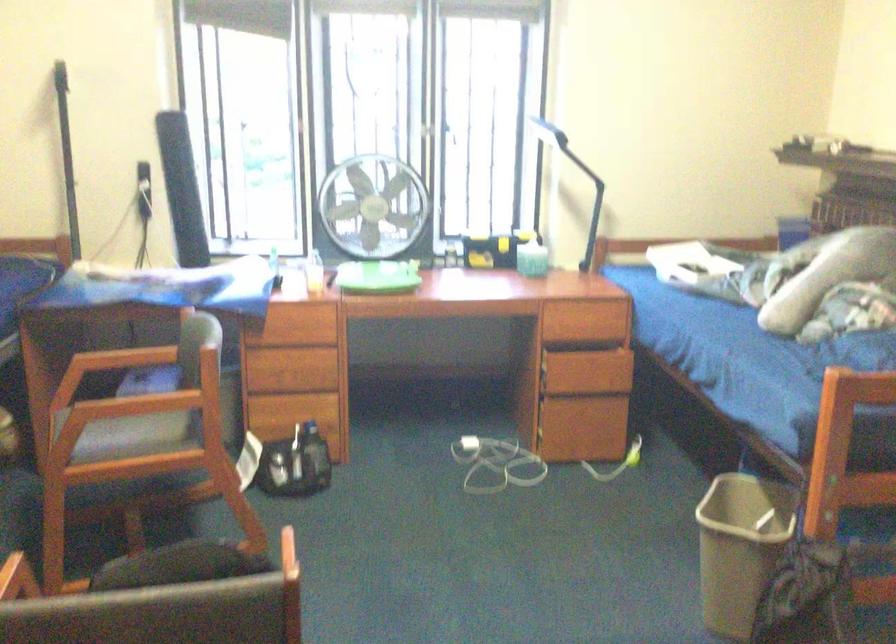
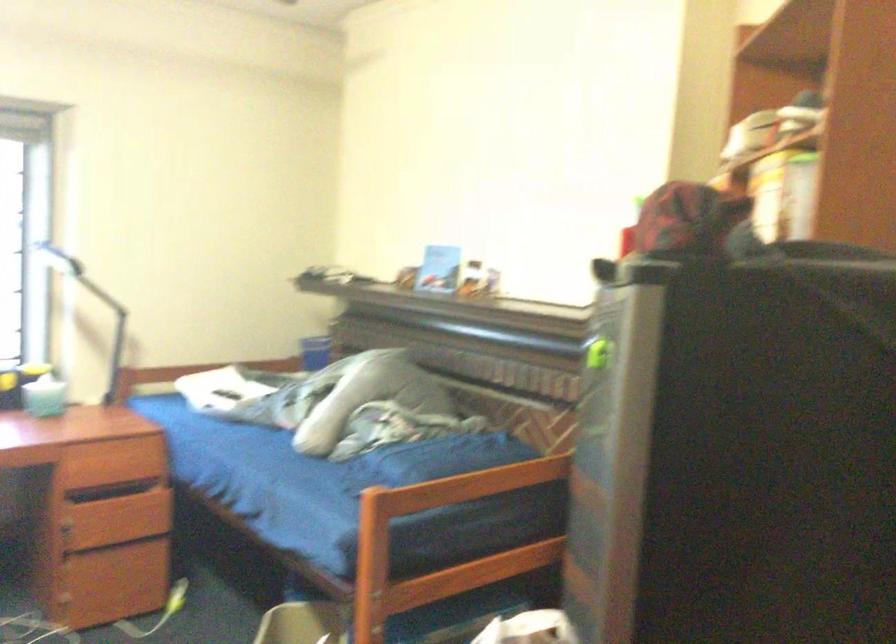
Question: The images are taken continuously from a first-person perspective. In which direction is your viewpoint rotating?

Choices:
 (A) Left
 (B) Right
 (C) Up
 (D) Down

Answer: (B)